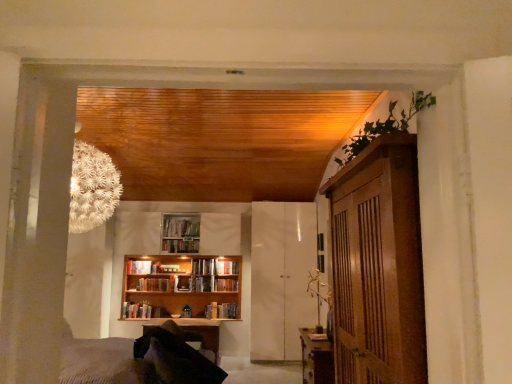
What are the coordinates of `hardcover book at center, which is the third book from top to bottom` in the screenshot? It's located at (226, 267).

In order to face wooden bookshelf at center, positioned as the 5th book in top-to-bottom order, should I rotate leftwards or rightwards?

To face it directly, rotate left by 13.343 degrees.

Locate an element on the screen. The image size is (512, 384). hardcover book at center, arranged as the fourth book when viewed from the top is located at coordinates (204, 267).

Is wooden bookshelf at center, which is the 1th book in top-to-bottom order, facing away from hardcover book at center, which is the third book from top to bottom?

wooden bookshelf at center, which is the 1th book in top-to-bottom order, is not turned away from hardcover book at center, which is the third book from top to bottom.

Is wooden bookshelf at center, which is the 1th book in top-to-bottom order, positioned beyond the bounds of hardcover book at center, the 4th book ordered from the bottom?

Yes, wooden bookshelf at center, which is the 1th book in top-to-bottom order, is not within hardcover book at center, the 4th book ordered from the bottom.

Which of these two, wooden bookshelf at center, which is the sixth book from bottom to top, or hardcover book at center, the 4th book ordered from the bottom, stands shorter?

Standing shorter between the two is wooden bookshelf at center, which is the sixth book from bottom to top.

Would you consider wooden bookshelf at center, which is the sixth book from bottom to top, to be distant from hardcover book at center, which is the third book from top to bottom?

No, wooden bookshelf at center, which is the sixth book from bottom to top, is not far away from hardcover book at center, which is the third book from top to bottom.

Considering the sizes of objects wooden bookcase at center and hardcover book at center, positioned as the third book in bottom-to-top order, in the image provided, who is thinner, wooden bookcase at center or hardcover book at center, positioned as the third book in bottom-to-top order,?

Thinner between the two is hardcover book at center, positioned as the third book in bottom-to-top order.

Can you see wooden bookcase at center touching hardcover book at center, arranged as the fourth book when viewed from the top?

No, wooden bookcase at center is not making contact with hardcover book at center, arranged as the fourth book when viewed from the top.

Is wooden bookcase at center outside of hardcover book at center, arranged as the fourth book when viewed from the top?

Yes, wooden bookcase at center is not within hardcover book at center, arranged as the fourth book when viewed from the top.

From a real-world perspective, is wooden bookcase at center on top of hardcover book at center, arranged as the fourth book when viewed from the top?

No, from a real-world perspective, wooden bookcase at center is not on top of hardcover book at center, arranged as the fourth book when viewed from the top.

Is wooden bookshelf at center, which is the 1th book in top-to-bottom order, bigger than wooden bookcase at center?

Incorrect, wooden bookshelf at center, which is the 1th book in top-to-bottom order, is not larger than wooden bookcase at center.

Is wooden bookshelf at center, which is the 1th book in top-to-bottom order, at the right side of wooden bookcase at center?

Indeed, wooden bookshelf at center, which is the 1th book in top-to-bottom order, is positioned on the right side of wooden bookcase at center.

From a real-world perspective, is wooden bookshelf at center, which is the 1th book in top-to-bottom order, located higher than wooden bookcase at center?

Correct, in the physical world, wooden bookshelf at center, which is the 1th book in top-to-bottom order, is higher than wooden bookcase at center.

From the image's perspective, who appears lower, wooden bookshelf at center, which is the sixth book from bottom to top, or wooden bookcase at center?

From the image's view, wooden bookcase at center is below.

Could you tell me if wooden bookshelf at center, which is the 1th book in top-to-bottom order, is turned towards wooden bookshelf at center, positioned as the 5th book in top-to-bottom order?

No, wooden bookshelf at center, which is the 1th book in top-to-bottom order, is not facing towards wooden bookshelf at center, positioned as the 5th book in top-to-bottom order.

Is point (190, 243) more distant than point (151, 286)?

Yes, it is behind point (151, 286).

Based on the photo, how different are the orientations of wooden bookshelf at center, which is the sixth book from bottom to top, and wooden bookshelf at center, positioned as the 5th book in top-to-bottom order, in degrees?

0.00274 degrees separate the facing orientations of wooden bookshelf at center, which is the sixth book from bottom to top, and wooden bookshelf at center, positioned as the 5th book in top-to-bottom order.

Is white glossy cabinet at center far away from wooden table at center, which is the second table in top-to-bottom order?

Yes.

Based on the photo, does white glossy cabinet at center turn towards wooden table at center, positioned as the 1th table in back-to-front order?

No, white glossy cabinet at center is not oriented towards wooden table at center, positioned as the 1th table in back-to-front order.

Which object is positioned more to the right, white glossy cabinet at center or wooden table at center, which is counted as the second table, starting from the front?

Positioned to the right is white glossy cabinet at center.

Which object is wider, white glossy cabinet at center or wooden table at center, which is counted as the second table, starting from the front?

wooden table at center, which is counted as the second table, starting from the front.

Based on their sizes in the image, would you say white glossy cabinet at center is bigger or smaller than wooden bookshelf at center, which is the 1th book in top-to-bottom order?

Clearly, white glossy cabinet at center is larger in size than wooden bookshelf at center, which is the 1th book in top-to-bottom order.

How many degrees apart are the facing directions of white glossy cabinet at center and wooden bookshelf at center, which is the 1th book in top-to-bottom order?

There is a 0.0864-degree angle between the facing directions of white glossy cabinet at center and wooden bookshelf at center, which is the 1th book in top-to-bottom order.

From the image's perspective, between white glossy cabinet at center and wooden bookshelf at center, which is the 1th book in top-to-bottom order, who is located below?

white glossy cabinet at center.

Looking at their sizes, would you say wooden bookcase at center is wider or thinner than hardcover book at center, marked as the 5th book in a bottom-to-top arrangement?

Considering their sizes, wooden bookcase at center looks broader than hardcover book at center, marked as the 5th book in a bottom-to-top arrangement.

Between wooden bookcase at center and hardcover book at center, marked as the 5th book in a bottom-to-top arrangement, which one has smaller size?

With smaller size is hardcover book at center, marked as the 5th book in a bottom-to-top arrangement.

Image resolution: width=512 pixels, height=384 pixels. Find the location of `bookcase below the hardcover book at center, marked as the 5th book in a bottom-to-top arrangement (from a real-world perspective)`. bookcase below the hardcover book at center, marked as the 5th book in a bottom-to-top arrangement (from a real-world perspective) is located at coordinates (179, 290).

Between wooden bookcase at center and hardcover book at center, marked as the 5th book in a bottom-to-top arrangement, which one is positioned in front?

wooden bookcase at center.

From a real-world perspective, starting from the wooden bookshelf at center, which is the sixth book from bottom to top, which book is the 1st one below it? Please provide its 2D coordinates.

[(226, 267)]

The image size is (512, 384). What are the coordinates of `bookcase to the left of hardcover book at center, arranged as the fourth book when viewed from the top` in the screenshot? It's located at (179, 290).

Estimate the real-world distances between objects in this image. Which object is closer to wooden table at center, which is the 2th table from right to left, wooden bookshelf at center, which is the sixth book from bottom to top, or wooden bookcase at center?

wooden bookcase at center is positioned closer to the anchor wooden table at center, which is the 2th table from right to left.

Looking at this image, estimate the real-world distances between objects in this image. Which object is closer to hardcover book at center, arranged as the fourth book when viewed from the top, wooden bookshelf at center, which ranks as the first book in bottom-to-top order, or wooden table at center, which is the second table in top-to-bottom order?

Based on the image, wooden table at center, which is the second table in top-to-bottom order, appears to be nearer to hardcover book at center, arranged as the fourth book when viewed from the top.

From the image, which object appears to be farther from hardcover book at center, marked as the 5th book in a bottom-to-top arrangement, wooden bookcase at center or wooden bookshelf at center, which ranks as the first book in bottom-to-top order?

wooden bookcase at center is positioned further to the anchor hardcover book at center, marked as the 5th book in a bottom-to-top arrangement.

Which object lies nearer to the anchor point hardcover book at center, marked as the 5th book in a bottom-to-top arrangement, wooden bookshelf at center, which is the sixth book from bottom to top, or wooden bookshelf at center, which ranks as the first book in bottom-to-top order?

wooden bookshelf at center, which is the sixth book from bottom to top, is closer to hardcover book at center, marked as the 5th book in a bottom-to-top arrangement.

When comparing their distances from white glossy cabinet at center, does hardcover book at center, the 2th book when ordered from top to bottom, or wooden bookshelf at center, positioned as the 5th book in top-to-bottom order, seem closer?

wooden bookshelf at center, positioned as the 5th book in top-to-bottom order, is positioned closer to the anchor white glossy cabinet at center.

Which object lies nearer to the anchor point hardcover book at center, arranged as the fourth book when viewed from the top, wooden table at right, arranged as the 2th table when viewed from the left, or hardcover book at center, the 2th book when ordered from top to bottom?

hardcover book at center, the 2th book when ordered from top to bottom.

From the picture: Based on their spatial positions, is wooden bookshelf at center, which is the sixth book from bottom to top, or hardcover book at center, marked as the 5th book in a bottom-to-top arrangement, further from wooden bookshelf at center, acting as the 6th book starting from the top?

wooden bookshelf at center, which is the sixth book from bottom to top, lies further to wooden bookshelf at center, acting as the 6th book starting from the top, than the other object.

Based on their spatial positions, is wooden cabinet at right or white glossy cabinet at center closer to hardcover book at center, the 4th book ordered from the bottom?

white glossy cabinet at center is positioned closer to the anchor hardcover book at center, the 4th book ordered from the bottom.

This screenshot has height=384, width=512. I want to click on bookcase between hardcover book at center, the 2th book when ordered from top to bottom, and wooden table at center, marked as the 1th table in a left-to-right arrangement, in the up-down direction, so click(179, 290).

Locate an element on the screen. The height and width of the screenshot is (384, 512). bookcase situated between hardcover book at center, marked as the 5th book in a bottom-to-top arrangement, and hardcover book at center, the 4th book ordered from the bottom, from left to right is located at coordinates (179, 290).

Find the location of `barn door between wooden table at right, positioned as the 1th table in top-to-bottom order, and hardcover book at center, marked as the 5th book in a bottom-to-top arrangement, from front to back`. barn door between wooden table at right, positioned as the 1th table in top-to-bottom order, and hardcover book at center, marked as the 5th book in a bottom-to-top arrangement, from front to back is located at coordinates (281, 278).

Image resolution: width=512 pixels, height=384 pixels. I want to click on bookcase between wooden bookshelf at center, which ranks as the first book in bottom-to-top order, and hardcover book at center, the 4th book ordered from the bottom, so click(x=179, y=290).